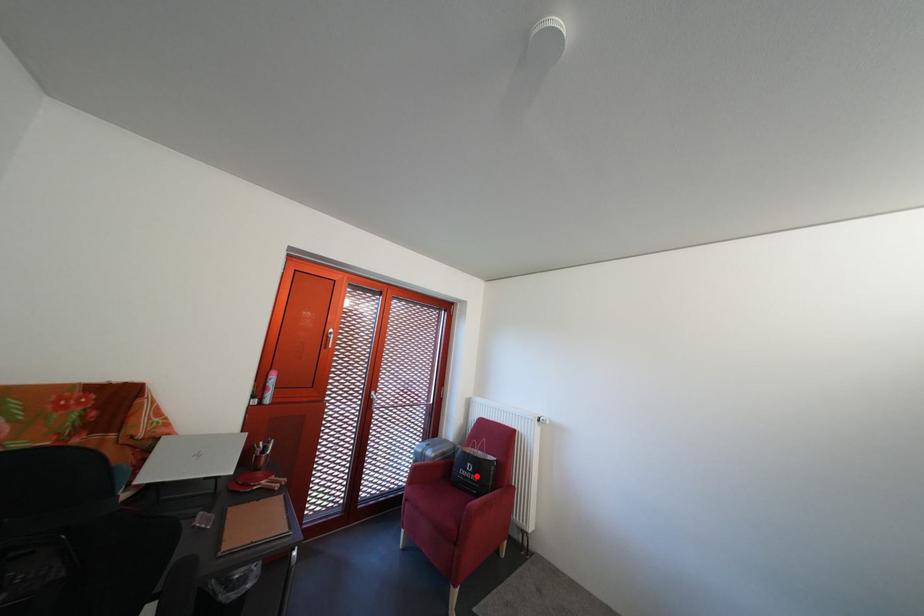
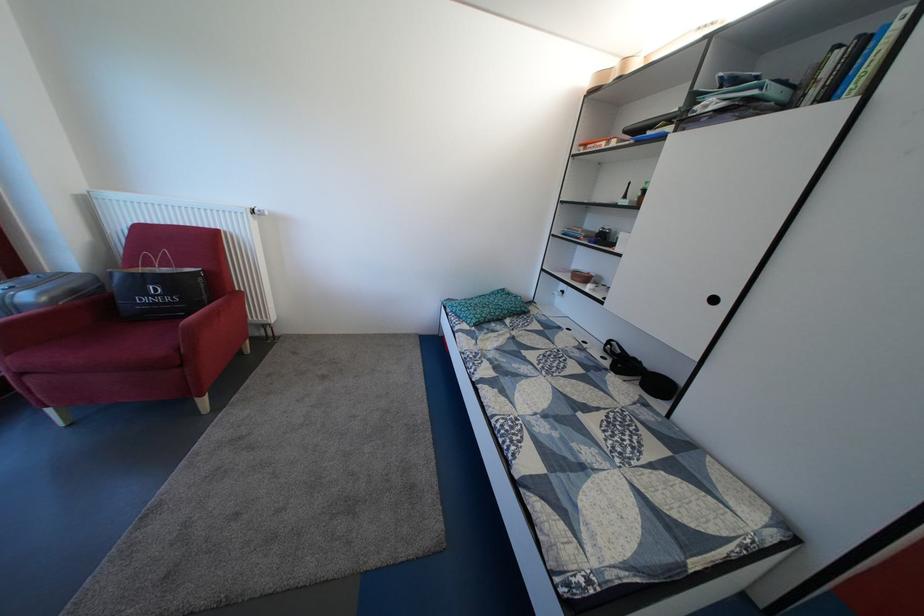
Question: I am providing you with two images of the same scene from different viewpoints. Given a red point in image1, look at the same physical point in image2. Is it:

Choices:
 (A) Closer to the viewpoint
 (B) Farther from the viewpoint

Answer: (A)